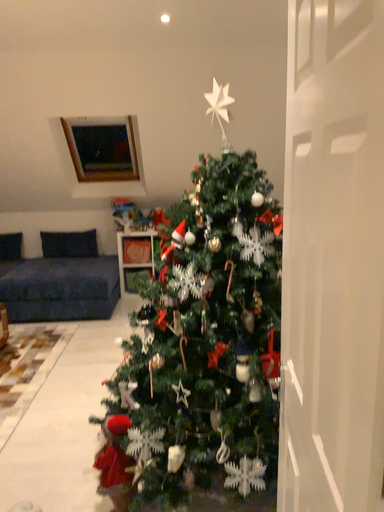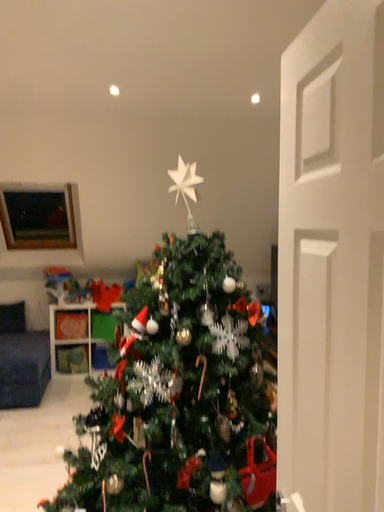
Question: How did the camera likely rotate when shooting the video?

Choices:
 (A) rotated right
 (B) rotated left

Answer: (A)